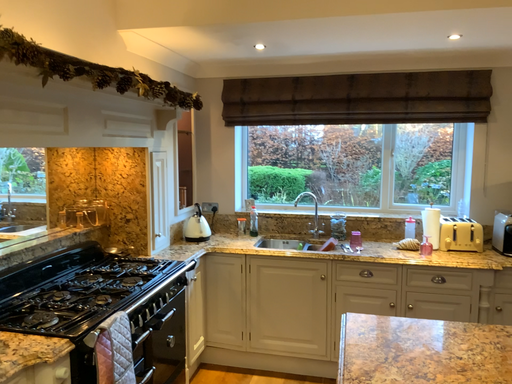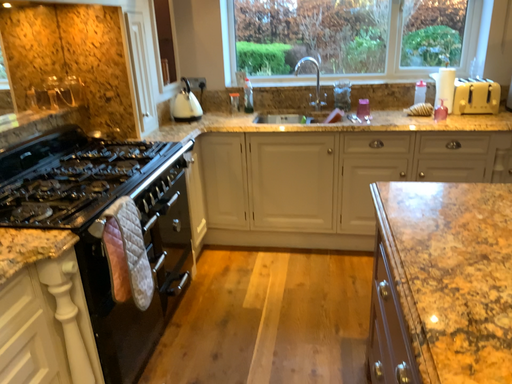
Question: How did the camera likely rotate when shooting the video?

Choices:
 (A) rotated upward
 (B) rotated downward

Answer: (B)